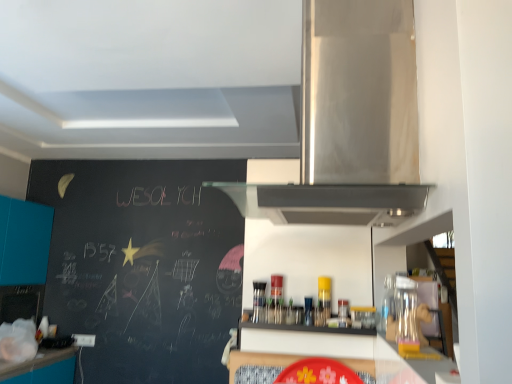
Question: Would you say stainless steel range hood at upper center is a long distance from black matte shelf at center?

Choices:
 (A) yes
 (B) no

Answer: (B)

Question: From a real-world perspective, does stainless steel range hood at upper center stand above black matte shelf at center?

Choices:
 (A) no
 (B) yes

Answer: (B)

Question: Is black matte shelf at center at the back of stainless steel range hood at upper center?

Choices:
 (A) no
 (B) yes

Answer: (A)

Question: Is the position of stainless steel range hood at upper center more distant than that of black matte shelf at center?

Choices:
 (A) yes
 (B) no

Answer: (B)

Question: Is stainless steel range hood at upper center shorter than black matte shelf at center?

Choices:
 (A) no
 (B) yes

Answer: (A)

Question: Can you confirm if stainless steel range hood at upper center is bigger than black matte shelf at center?

Choices:
 (A) no
 (B) yes

Answer: (B)

Question: Can you confirm if teal matte cabinet at left is taller than black matte shelf at center?

Choices:
 (A) yes
 (B) no

Answer: (A)

Question: Is teal matte cabinet at left at the right side of black matte shelf at center?

Choices:
 (A) yes
 (B) no

Answer: (B)

Question: Is teal matte cabinet at left surrounding black matte shelf at center?

Choices:
 (A) no
 (B) yes

Answer: (A)

Question: Can you confirm if teal matte cabinet at left is thinner than black matte shelf at center?

Choices:
 (A) no
 (B) yes

Answer: (A)

Question: From a real-world perspective, does teal matte cabinet at left stand above black matte shelf at center?

Choices:
 (A) yes
 (B) no

Answer: (A)

Question: Does teal matte cabinet at left have a lesser height compared to black matte shelf at center?

Choices:
 (A) yes
 (B) no

Answer: (B)

Question: From the image's perspective, would you say black matte shelf at center is positioned over teal matte cabinet at left?

Choices:
 (A) yes
 (B) no

Answer: (A)